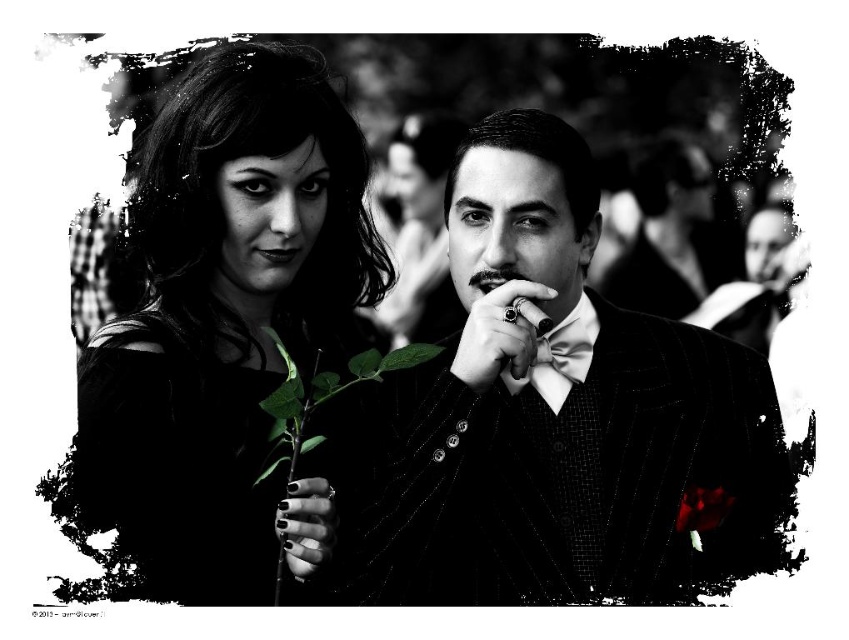
Looking at this image, measure the distance from black polished ring at center to green leafy stem at center.

30.18 centimeters

Between black polished ring at center and green leafy stem at center, which one is positioned lower?

green leafy stem at center

What do you see at coordinates (499, 332) in the screenshot? This screenshot has width=849, height=640. I see `black polished ring at center` at bounding box center [499, 332].

Locate an element on the screen. This screenshot has width=849, height=640. black polished ring at center is located at coordinates (499, 332).

From the picture: Who is more distant from viewer, (496, 269) or (291, 513)?

Positioned behind is point (496, 269).

Is textured pinstripe suit at center closer to the viewer compared to black matte nails at center?

Yes.

Who is more forward, (605, 330) or (307, 492)?

Positioned in front is point (307, 492).

Locate an element on the screen. textured pinstripe suit at center is located at coordinates (555, 417).

Which is more to the right, textured pinstripe suit at center or green leafy plant at lower left?

textured pinstripe suit at center is more to the right.

Is textured pinstripe suit at center positioned at the back of green leafy plant at lower left?

No.

What do you see at coordinates (555, 417) in the screenshot?
I see `textured pinstripe suit at center` at bounding box center [555, 417].

You are a GUI agent. You are given a task and a screenshot of the screen. Output one action in this format:
    pyautogui.click(x=<x>, y=<y>)
    Task: Click on the textured pinstripe suit at center
    
    Given the screenshot: What is the action you would take?
    [555, 417]